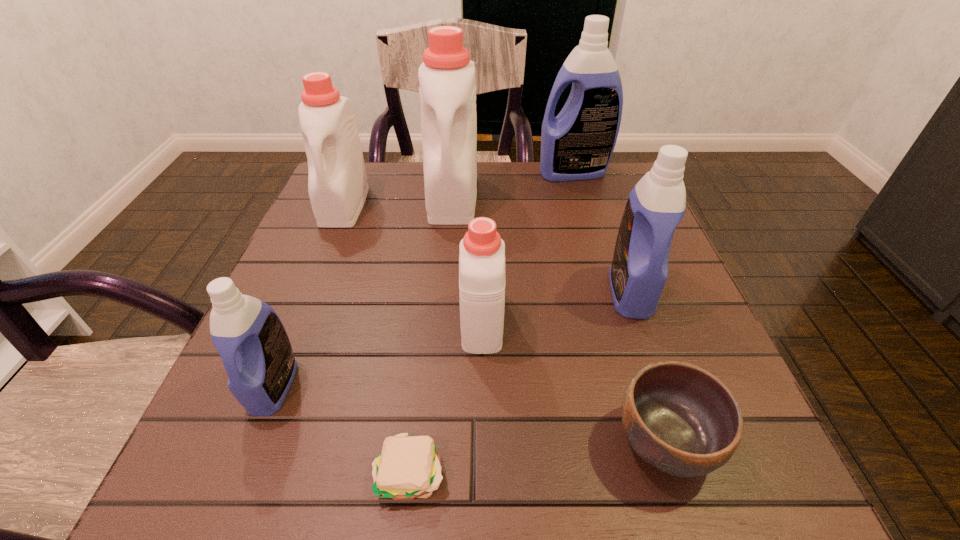
This screenshot has width=960, height=540. In order to click on vacant area that lies between the second nearest blue detergent and the biggest white detergent in this screenshot , I will do `click(541, 245)`.

Locate which object is the fifth closest to the second farthest blue detergent. Please provide its 2D coordinates. Your answer should be formatted as a tuple, i.e. [(x, y)], where the tuple contains the x and y coordinates of a point satisfying the conditions above.

[(408, 467)]

Image resolution: width=960 pixels, height=540 pixels. Find the location of `the sixth closest object to the patty`. the sixth closest object to the patty is located at coordinates click(337, 180).

Select which detergent appears as the fifth closest to the smallest white detergent. Please provide its 2D coordinates. Your answer should be formatted as a tuple, i.e. [(x, y)], where the tuple contains the x and y coordinates of a point satisfying the conditions above.

[(577, 144)]

Image resolution: width=960 pixels, height=540 pixels. In order to click on detergent that can be found as the closest to the nearest white detergent in this screenshot , I will do `click(656, 205)`.

Identify the location of the second closest white detergent relative to the smallest white detergent. The height and width of the screenshot is (540, 960). (337, 180).

Locate which white detergent ranks third in proximity to the second farthest blue detergent. Please provide its 2D coordinates. Your answer should be formatted as a tuple, i.e. [(x, y)], where the tuple contains the x and y coordinates of a point satisfying the conditions above.

[(337, 180)]

Choose which blue detergent is the nearest neighbor to the biggest blue detergent. Please provide its 2D coordinates. Your answer should be formatted as a tuple, i.e. [(x, y)], where the tuple contains the x and y coordinates of a point satisfying the conditions above.

[(656, 205)]

Find the location of `blue detergent identified as the third closest to the smallest white detergent`. blue detergent identified as the third closest to the smallest white detergent is located at coordinates 577,144.

Identify the location of vacant space that satisfies the following two spatial constraints: 1. on the handle side of the second smallest blue detergent; 2. on the left side of the biggest white detergent. (444, 292).